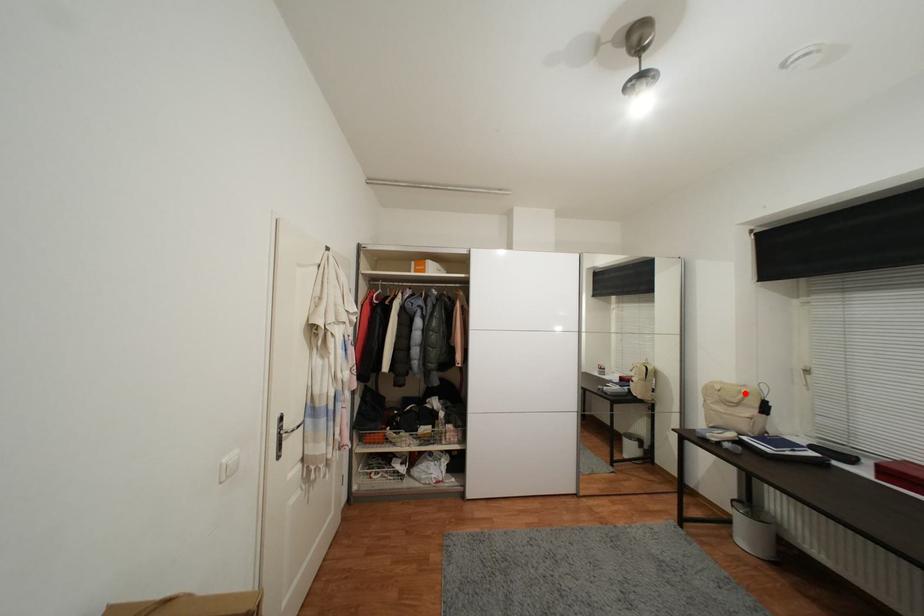
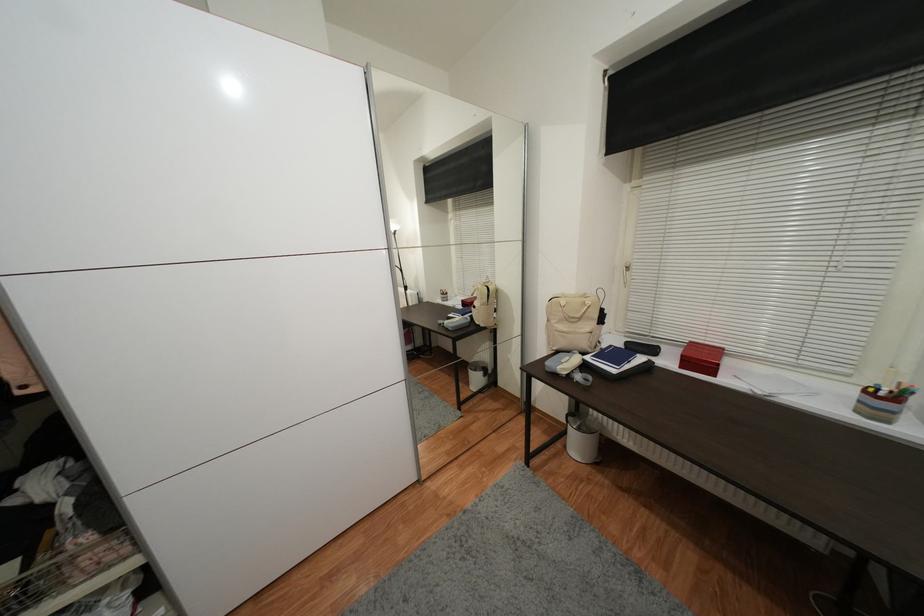
In the second image, find the point that corresponds to the highlighted location in the first image.

(589, 305)